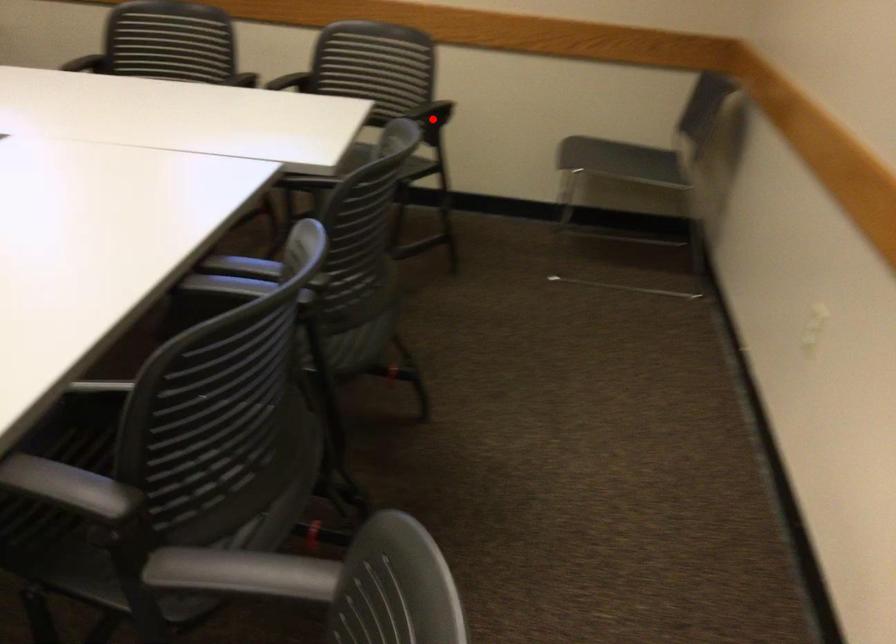
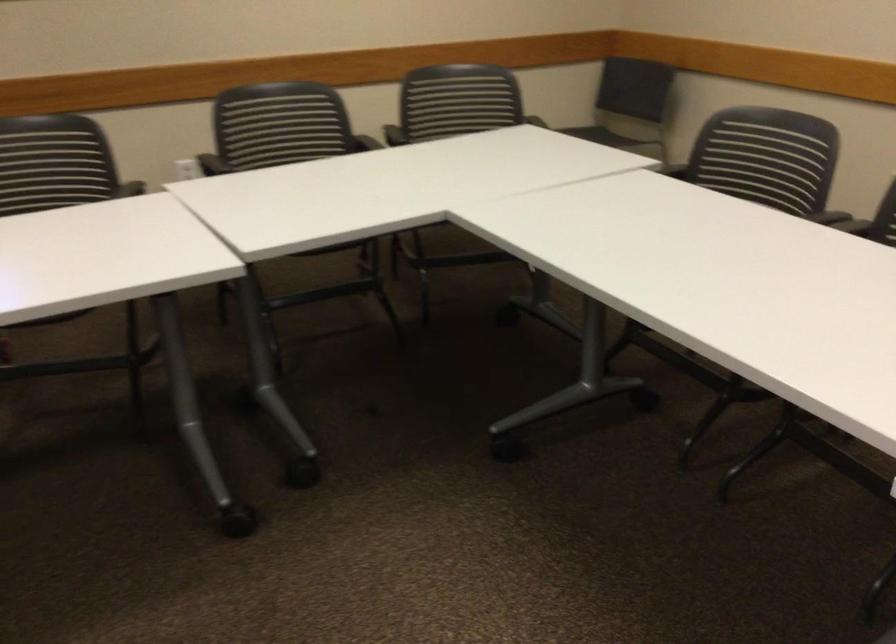
Question: I am providing you with two images of the same scene from different viewpoints. A red point is marked on the first image. At the location where the point appears in image 1, is it still visible in image 2?

Choices:
 (A) Yes
 (B) No

Answer: (B)